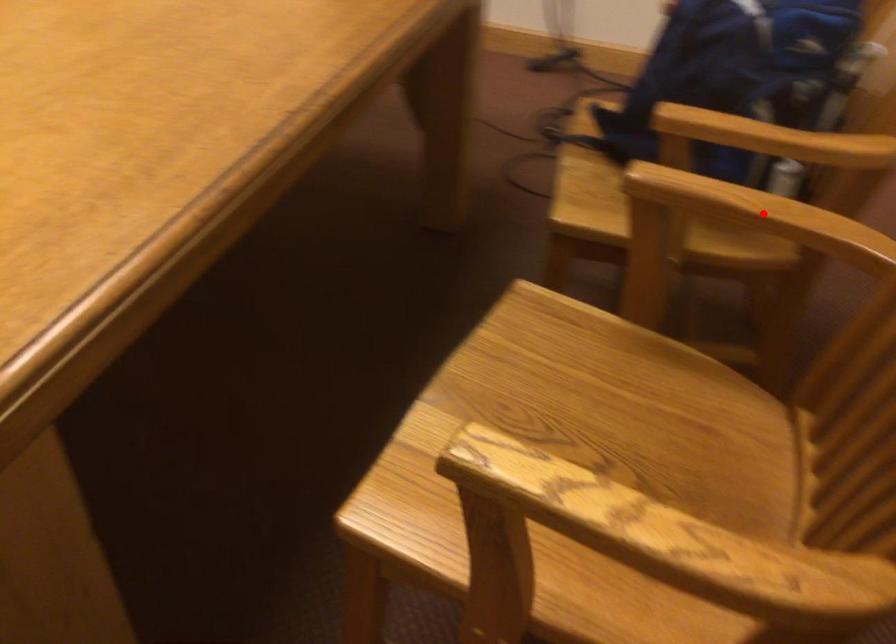
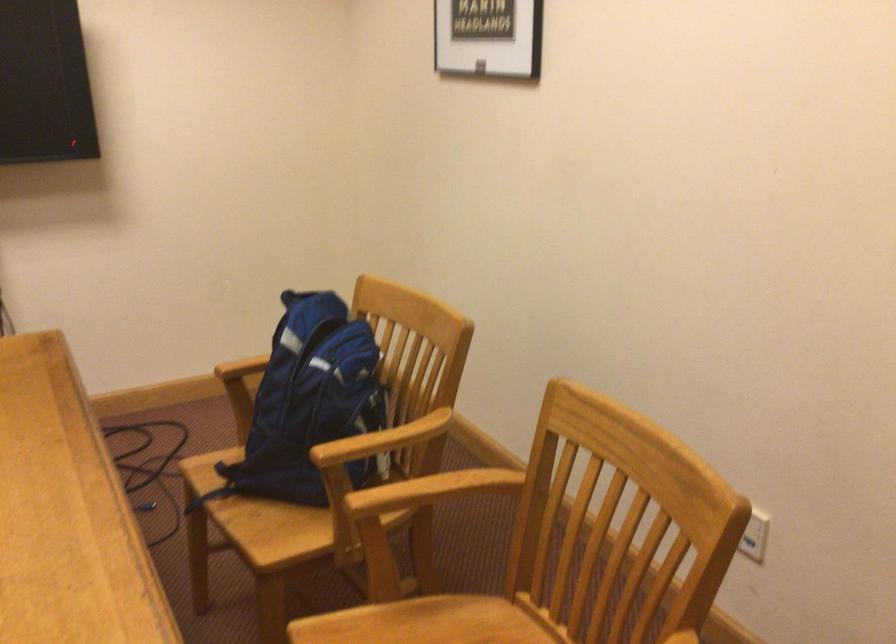
Question: I am providing you with two images of the same scene from different viewpoints. A red point is shown in image1. For the corresponding object point in image2, is it positioned nearer or farther from the camera?

Choices:
 (A) Nearer
 (B) Farther

Answer: (B)